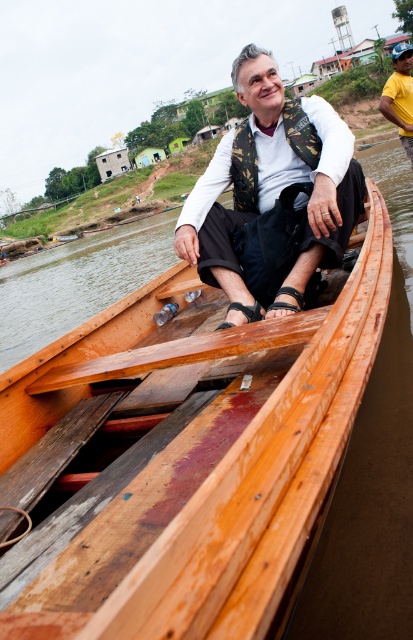
Between wooden paddle at center and yellow cotton shirt at right, which one has more height?

yellow cotton shirt at right

Looking at this image, between wooden paddle at center and yellow cotton shirt at right, which one appears on the left side from the viewer's perspective?

Positioned to the left is wooden paddle at center.

Is point (113, 362) positioned before point (403, 109)?

That is True.

Locate an element on the screen. The width and height of the screenshot is (413, 640). wooden paddle at center is located at coordinates (185, 349).

Is point (56, 401) behind point (28, 392)?

Yes, point (56, 401) is behind point (28, 392).

Between wooden boat at center and wooden paddle at center, which one is positioned lower?

Positioned lower is wooden paddle at center.

This screenshot has height=640, width=413. In order to click on wooden boat at center in this screenshot , I will do `click(182, 458)`.

Identify the location of wooden boat at center. (182, 458).

Is point (275, 257) farther from camera compared to point (387, 96)?

No, it is in front of (387, 96).

Which is below, camouflage fabric vest at center or yellow cotton shirt at right?

camouflage fabric vest at center is lower down.

Is point (211, 253) behind point (405, 122)?

No, it is not.

Where is `camouflage fabric vest at center`? Image resolution: width=413 pixels, height=640 pixels. camouflage fabric vest at center is located at coordinates (272, 196).